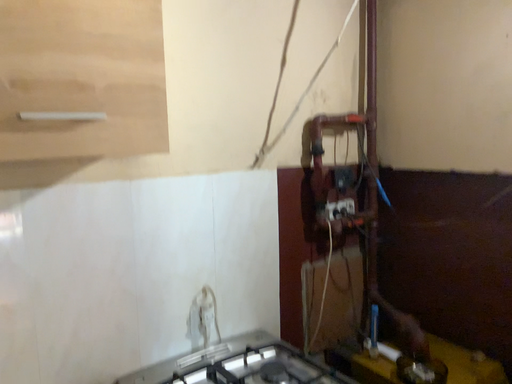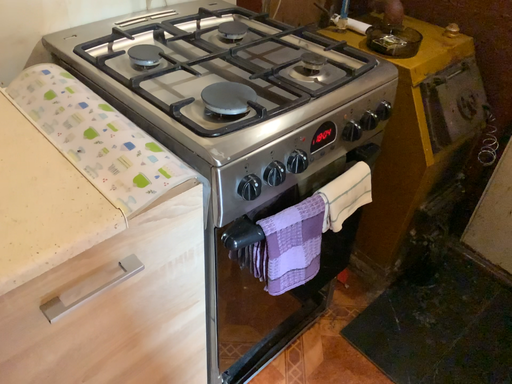
Question: Which way did the camera rotate in the video?

Choices:
 (A) rotated left
 (B) rotated right

Answer: (B)